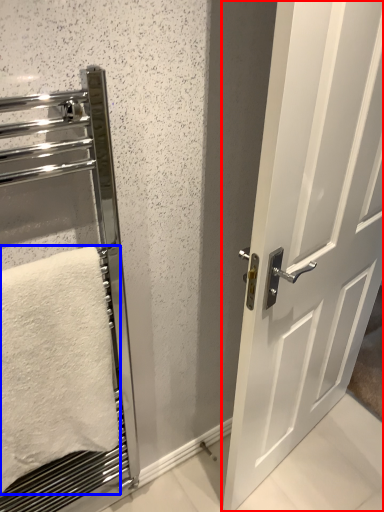
Question: Among these objects, which one is farthest to the camera, door (highlighted by a red box) or towel (highlighted by a blue box)?

Choices:
 (A) door
 (B) towel

Answer: (B)